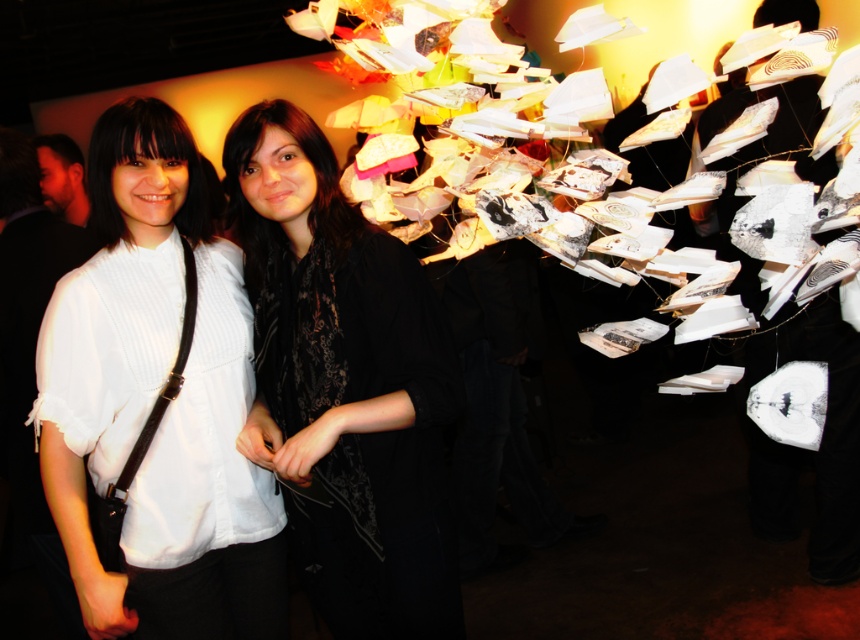
Which is more to the left, white matte shirt at center or black lace scarf at center?

Positioned to the left is white matte shirt at center.

The width and height of the screenshot is (860, 640). Find the location of `white matte shirt at center`. white matte shirt at center is located at coordinates (157, 397).

Locate an element on the screen. white matte shirt at center is located at coordinates (157, 397).